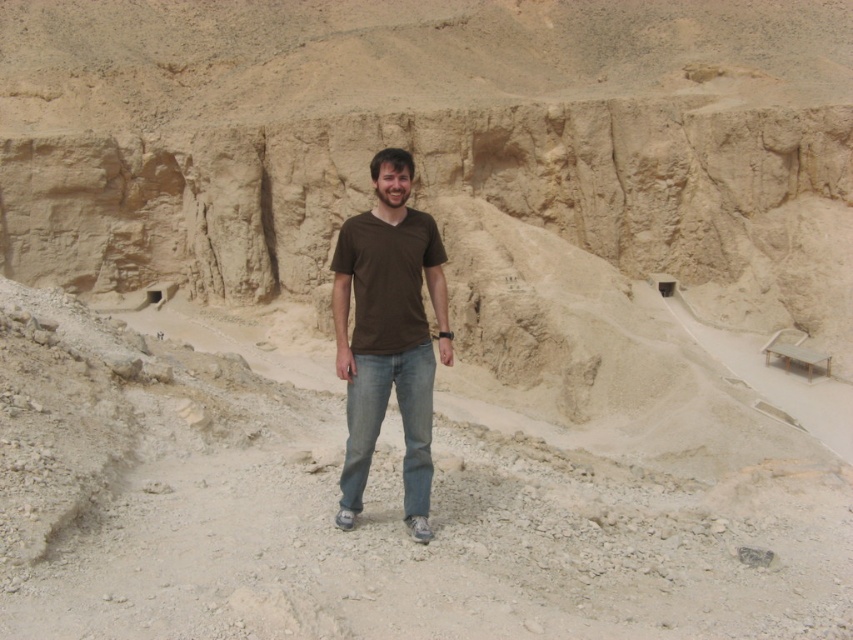
Is brown cotton t-shirt at center smaller than blue denim jeans at center?

No.

Who is more distant from viewer, [384,406] or [387,358]?

The point [387,358] is behind.

Where is `brown cotton t-shirt at center`? The width and height of the screenshot is (853, 640). brown cotton t-shirt at center is located at coordinates (387, 333).